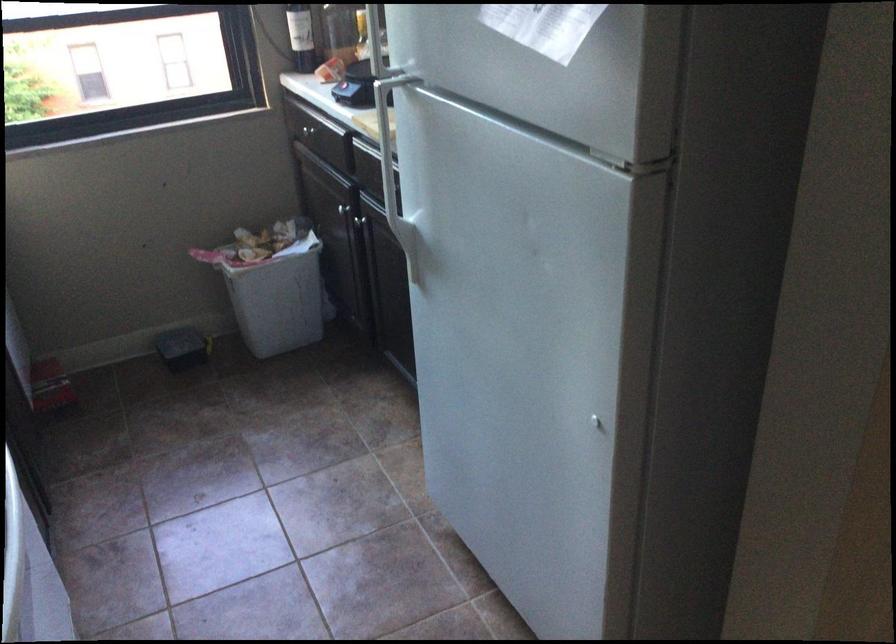
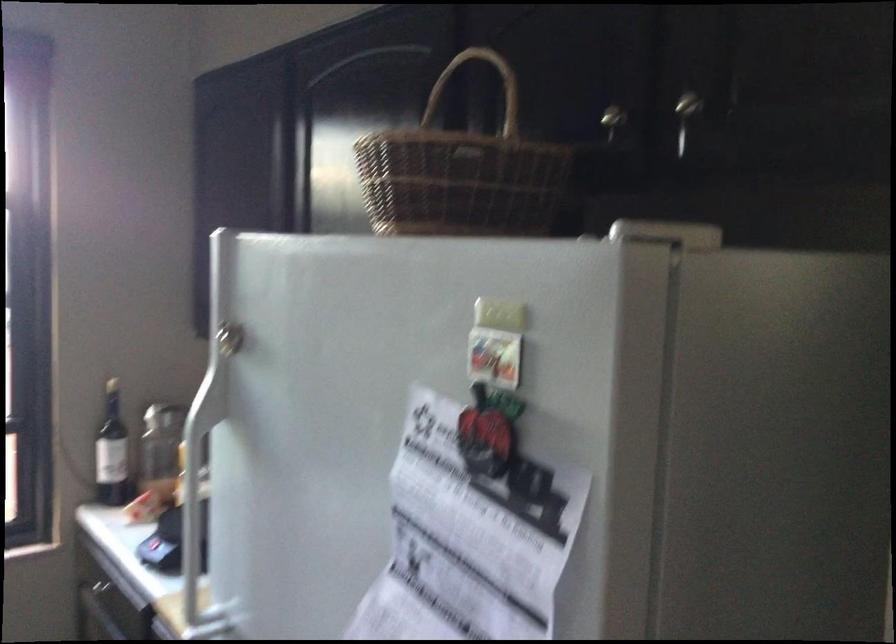
Question: How did the camera likely rotate?

Choices:
 (A) Left
 (B) Right
 (C) Up
 (D) Down

Answer: (C)